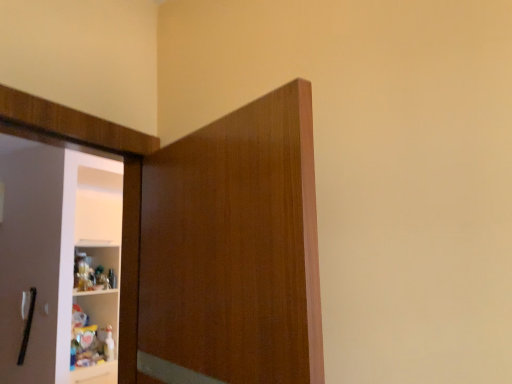
Describe the element at coordinates (27, 326) in the screenshot. I see `black matte door handle at left` at that location.

The width and height of the screenshot is (512, 384). I want to click on black matte door handle at left, so [27, 326].

The height and width of the screenshot is (384, 512). I want to click on matte wood cupboard at center, so click(x=212, y=239).

What do you see at coordinates (212, 239) in the screenshot?
I see `matte wood cupboard at center` at bounding box center [212, 239].

What is the approximate height of matte wood cupboard at center?

matte wood cupboard at center is 30.22 inches tall.

Locate an element on the screen. The height and width of the screenshot is (384, 512). black matte door handle at left is located at coordinates (27, 326).

Can you confirm if black matte door handle at left is positioned to the right of matte wood cupboard at center?

Incorrect, black matte door handle at left is not on the right side of matte wood cupboard at center.

Relative to matte wood cupboard at center, is black matte door handle at left in front or behind?

black matte door handle at left is behind matte wood cupboard at center.

Considering the points (25, 333) and (258, 140), which point is in front, point (25, 333) or point (258, 140)?

The point (258, 140) is in front.

From the image's perspective, is black matte door handle at left positioned above or below matte wood cupboard at center?

Clearly, from the image's perspective, black matte door handle at left is below matte wood cupboard at center.

From a real-world perspective, is black matte door handle at left physically located above or below matte wood cupboard at center?

black matte door handle at left is below matte wood cupboard at center.

Considering the sizes of black matte door handle at left and matte wood cupboard at center in the image, is black matte door handle at left wider or thinner than matte wood cupboard at center?

black matte door handle at left is thinner than matte wood cupboard at center.

Considering the sizes of objects black matte door handle at left and matte wood cupboard at center in the image provided, who is taller, black matte door handle at left or matte wood cupboard at center?

Standing taller between the two is matte wood cupboard at center.

Based on the photo, can you confirm if black matte door handle at left is bigger than matte wood cupboard at center?

Actually, black matte door handle at left might be smaller than matte wood cupboard at center.

Is black matte door handle at left inside or outside of matte wood cupboard at center?

black matte door handle at left is outside matte wood cupboard at center.

Is black matte door handle at left in contact with matte wood cupboard at center?

No, black matte door handle at left is not beside matte wood cupboard at center.

Is black matte door handle at left looking in the opposite direction of matte wood cupboard at center?

No.

What's the angular difference between black matte door handle at left and matte wood cupboard at center's facing directions?

The angle between the facing direction of black matte door handle at left and the facing direction of matte wood cupboard at center is 18 degrees.

Where is `cupboard in front of the black matte door handle at left`? cupboard in front of the black matte door handle at left is located at coordinates (212, 239).

Considering the relative positions of matte wood cupboard at center and black matte door handle at left in the image provided, is matte wood cupboard at center to the right of black matte door handle at left from the viewer's perspective?

Yes, matte wood cupboard at center is to the right of black matte door handle at left.

Is matte wood cupboard at center in front of or behind black matte door handle at left in the image?

Visually, matte wood cupboard at center is located in front of black matte door handle at left.

Considering the positions of point (149, 200) and point (19, 355), is point (149, 200) closer or farther from the camera than point (19, 355)?

Point (149, 200) appears to be closer to the viewer than point (19, 355).

From the image's perspective, is matte wood cupboard at center over black matte door handle at left?

Indeed, from the image's perspective, matte wood cupboard at center is shown above black matte door handle at left.

From a real-world perspective, is matte wood cupboard at center positioned above or below black matte door handle at left?

In terms of real-world spatial position, matte wood cupboard at center is above black matte door handle at left.

Between matte wood cupboard at center and black matte door handle at left, which one has smaller width?

Thinner between the two is black matte door handle at left.

Does matte wood cupboard at center have a greater height compared to black matte door handle at left?

Yes, matte wood cupboard at center is taller than black matte door handle at left.

Considering the sizes of matte wood cupboard at center and black matte door handle at left in the image, is matte wood cupboard at center bigger or smaller than black matte door handle at left?

matte wood cupboard at center is bigger than black matte door handle at left.

Is matte wood cupboard at center not within black matte door handle at left?

Indeed, matte wood cupboard at center is completely outside black matte door handle at left.

Is there a large distance between matte wood cupboard at center and black matte door handle at left?

matte wood cupboard at center is positioned a significant distance from black matte door handle at left.

Could you tell me if matte wood cupboard at center is turned towards black matte door handle at left?

No, matte wood cupboard at center is not oriented towards black matte door handle at left.

Measure the distance from matte wood cupboard at center to black matte door handle at left.

The distance of matte wood cupboard at center from black matte door handle at left is 8.80 feet.

Identify the location of door handle on the left side of matte wood cupboard at center. (27, 326).

Image resolution: width=512 pixels, height=384 pixels. What are the coordinates of `door handle on the left of matte wood cupboard at center` in the screenshot? It's located at (27, 326).

The width and height of the screenshot is (512, 384). What are the coordinates of `cupboard above the black matte door handle at left (from the image's perspective)` in the screenshot? It's located at (212, 239).